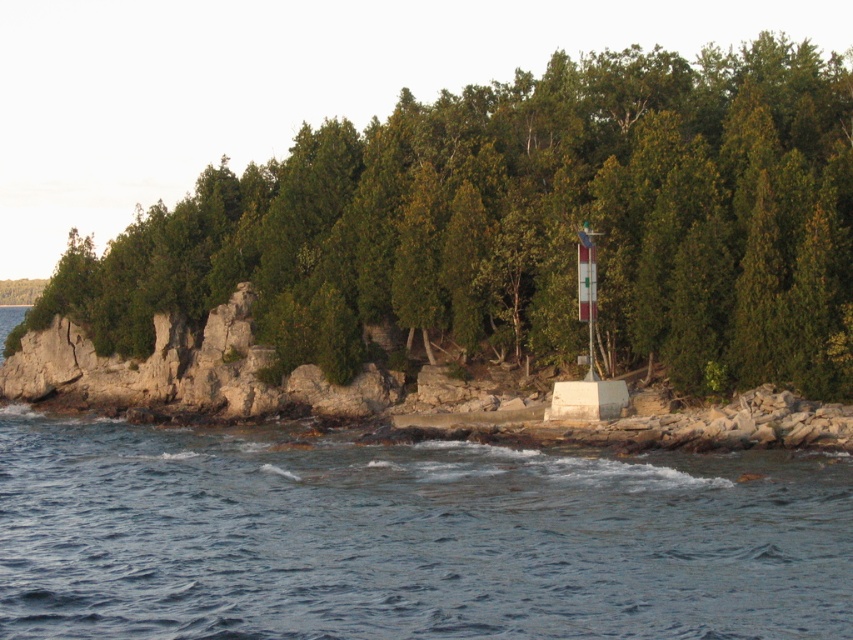
Can you confirm if green matte tree at center is smaller than blue water at lower center?

No.

Which is above, green matte tree at center or blue water at lower center?

Positioned higher is green matte tree at center.

Consider the image. Who is more distant from viewer, (94, 342) or (780, 630)?

Point (94, 342)

I want to click on green matte tree at center, so click(526, 225).